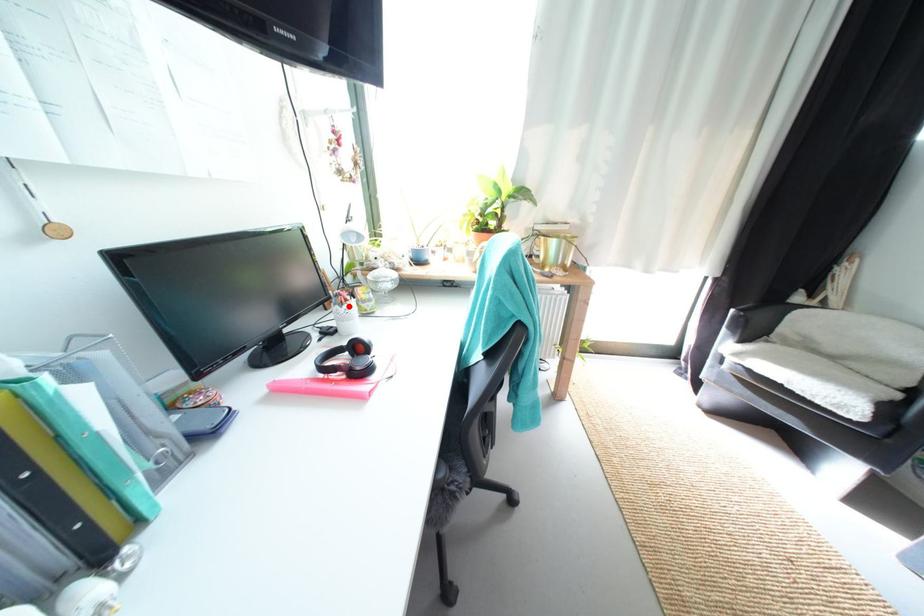
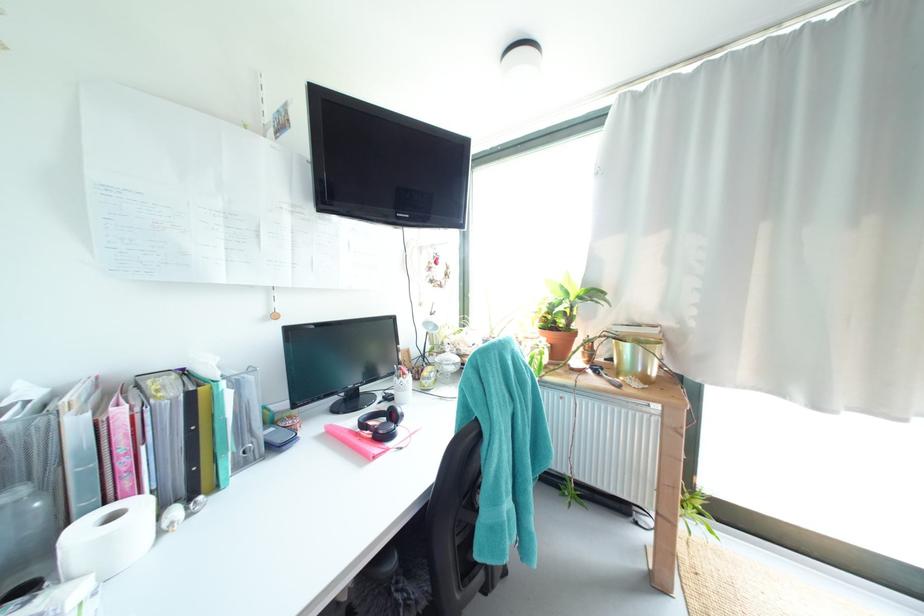
Locate, in the second image, the point that corresponds to the highlighted location in the first image.

(407, 379)